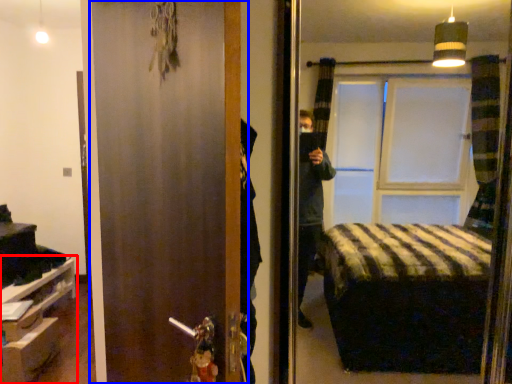
Question: Among these objects, which one is nearest to the camera, furniture (highlighted by a red box) or door (highlighted by a blue box)?

Choices:
 (A) furniture
 (B) door

Answer: (B)